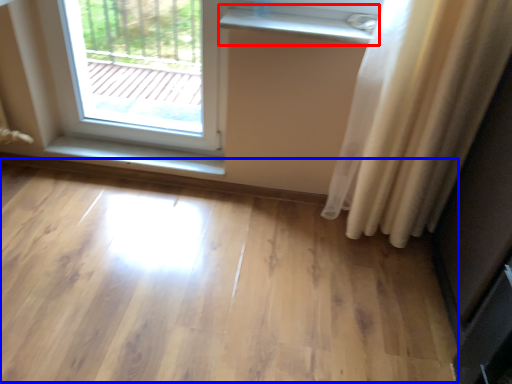
Question: Which object is further to the camera taking this photo, window sill (highlighted by a red box) or plain (highlighted by a blue box)?

Choices:
 (A) window sill
 (B) plain

Answer: (A)